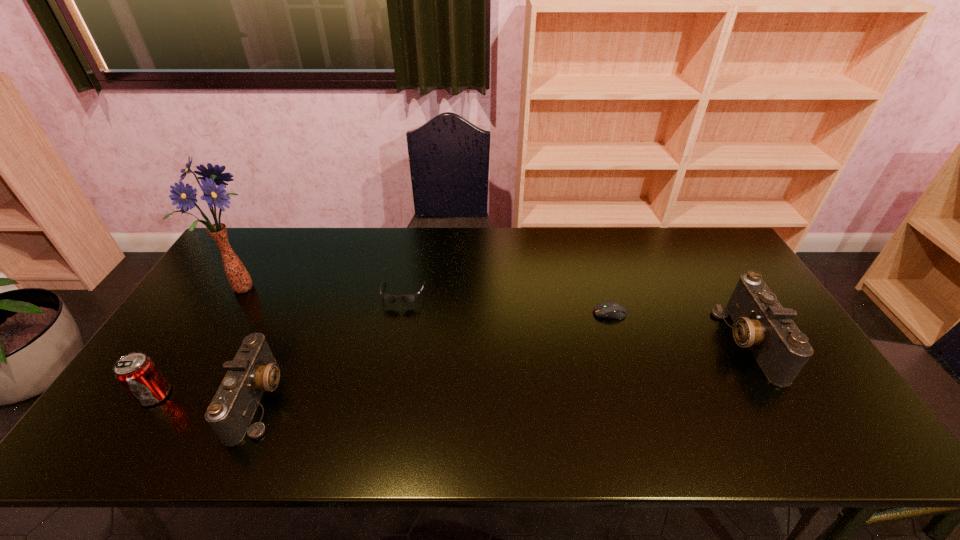
Locate an element on the screen. The width and height of the screenshot is (960, 540). pop soda at the near edge is located at coordinates (137, 373).

The image size is (960, 540). I want to click on flower arrangement located at the left edge, so click(x=238, y=277).

In order to click on pop soda situated at the left edge in this screenshot , I will do `click(137, 373)`.

The width and height of the screenshot is (960, 540). I want to click on object that is at the right edge, so click(x=761, y=324).

At what (x,y) coordinates should I click in order to perform the action: click on object located in the near left corner section of the desktop. Please return your answer as a coordinate pair (x, y). Looking at the image, I should click on [137, 373].

Find the location of a particular element. Image resolution: width=960 pixels, height=540 pixels. object that is at the near right corner is located at coordinates (761, 324).

What are the coordinates of `free region at the far edge of the desktop` in the screenshot? It's located at (606, 244).

This screenshot has width=960, height=540. I want to click on free space at the near edge of the desktop, so point(594,400).

The image size is (960, 540). Identify the location of vacant space at the left edge of the desktop. (209, 309).

I want to click on blank space at the far left corner, so click(x=276, y=238).